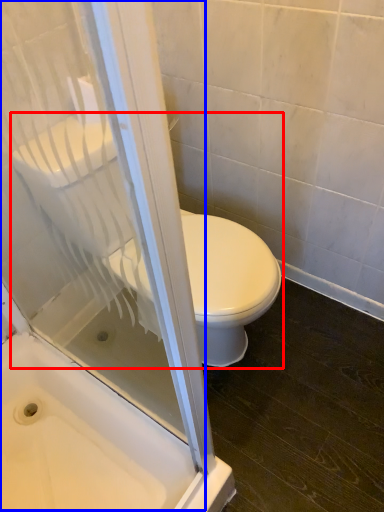
Question: Which point is closer to the camera, toilet (highlighted by a red box) or screen door (highlighted by a blue box)?

Choices:
 (A) toilet
 (B) screen door

Answer: (B)